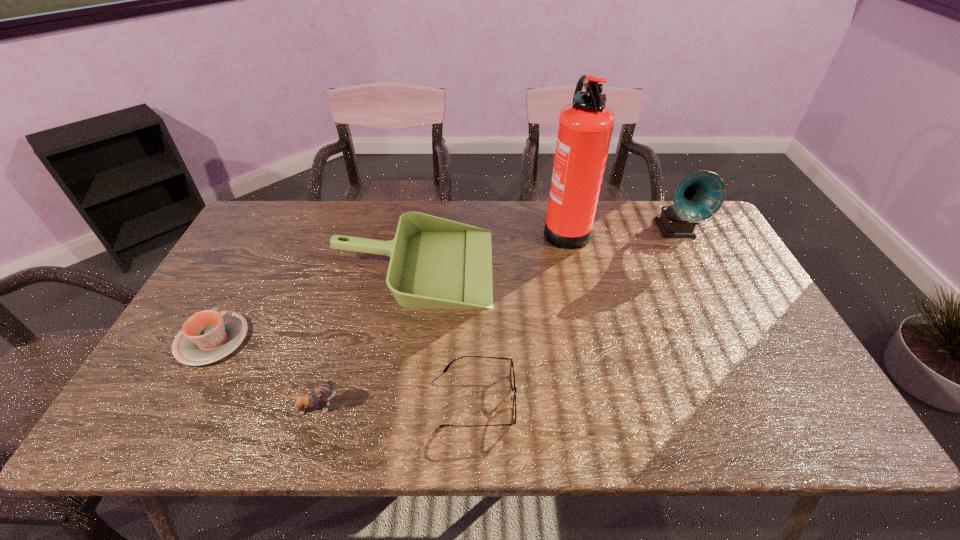
In the image, there is a desktop. In order to click on vacant space at the near left corner in this screenshot , I will do `click(178, 439)`.

This screenshot has height=540, width=960. I want to click on vacant space in between the second tallest object and the tallest object, so click(x=620, y=229).

Identify the location of free space between the dustpan and the fifth shortest object. (545, 248).

The width and height of the screenshot is (960, 540). I want to click on blank region between the spectacles and the dustpan, so click(x=446, y=332).

You are a GUI agent. You are given a task and a screenshot of the screen. Output one action in this format:
    pyautogui.click(x=<x>, y=<y>)
    Task: Click on the free spot between the spectacles and the rightmost object
    
    Given the screenshot: What is the action you would take?
    pyautogui.click(x=577, y=314)

Image resolution: width=960 pixels, height=540 pixels. I want to click on vacant space in between the second tallest object and the fourth tallest object, so click(x=494, y=319).

Locate an element on the screen. Image resolution: width=960 pixels, height=540 pixels. vacant region between the leftmost object and the dustpan is located at coordinates (314, 303).

Locate an element on the screen. The image size is (960, 540). free space between the spectacles and the tallest object is located at coordinates (522, 313).

Locate an element on the screen. object that ranks as the third closest to the shortest object is located at coordinates (585, 128).

Locate an element on the screen. The width and height of the screenshot is (960, 540). object that ranks as the closest to the second shortest object is located at coordinates pyautogui.click(x=435, y=263).